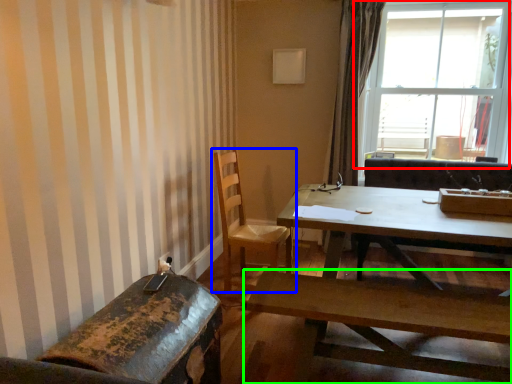
Question: Which object is the closest to the window (highlighted by a red box)? Choose among these: chair (highlighted by a blue box) or coffee table (highlighted by a green box).

Choices:
 (A) chair
 (B) coffee table

Answer: (A)